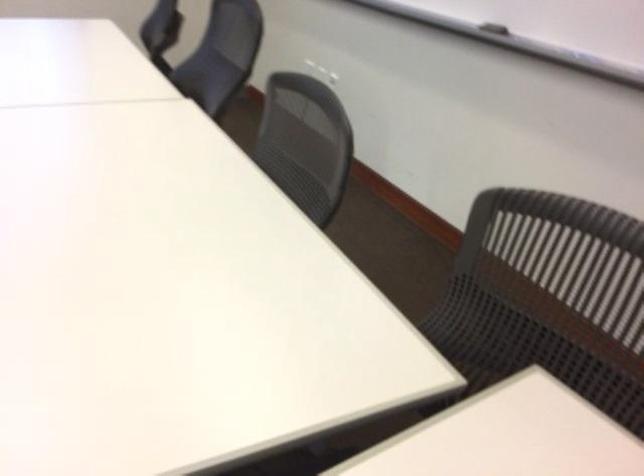
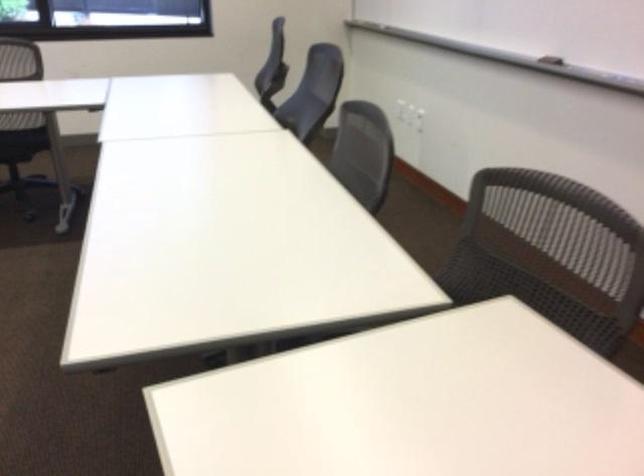
In a continuous first-person perspective shot, in which direction is the camera moving?

The cameraman moved toward right, backward.